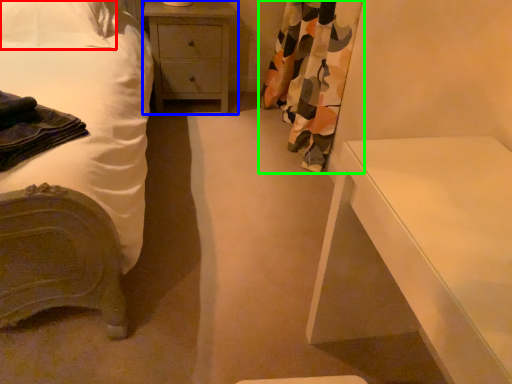
Question: Which is farther away from pillow (highlighted by a red box)? chest of drawers (highlighted by a blue box) or curtain (highlighted by a green box)?

Choices:
 (A) chest of drawers
 (B) curtain

Answer: (B)